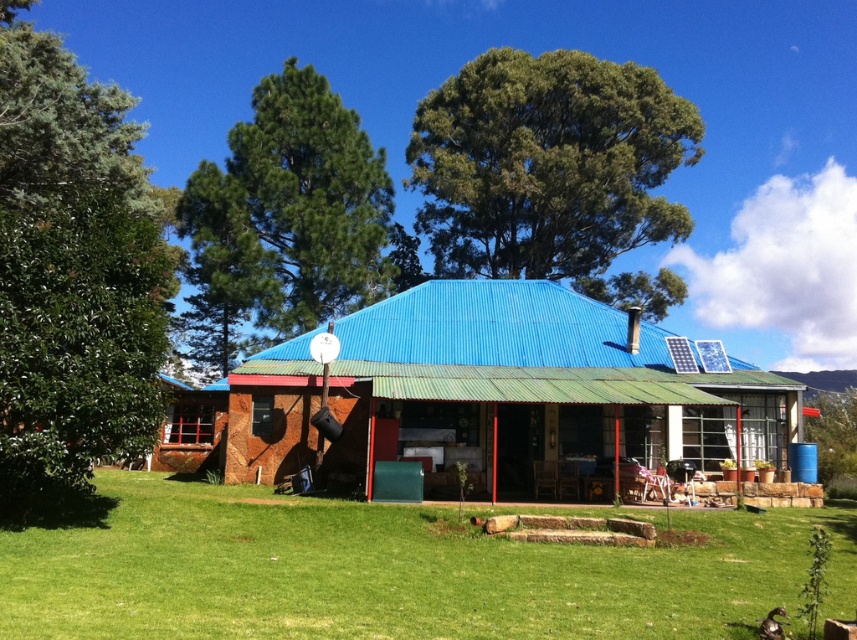
You are a delivery drone flying towards the blue corrugated metal hut at center and the green leafy tree at upper center. Which object will appear larger in your camera view as you approach?

The green leafy tree at upper center will appear larger in your camera view as you approach because it is bigger than the blue corrugated metal hut at center.

Looking at this image, you are standing on the front porch of the house and want to walk towards the green leafy tree at left. Which direction should you move relative to the green grass at center?

Since the green grass at center is in front of the green leafy tree at left, you should move behind the green grass at center to reach the green leafy tree at left.